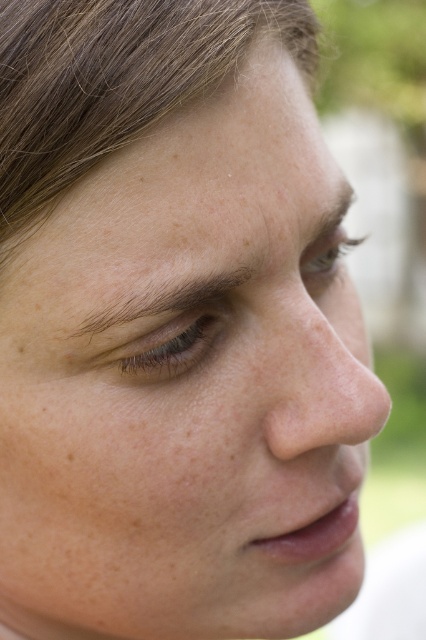
Question: Does brown smooth hair at upper left have a greater width compared to smooth skin nose at center?

Choices:
 (A) yes
 (B) no

Answer: (A)

Question: In this image, where is brown smooth hair at upper left located relative to smooth skin nose at center?

Choices:
 (A) above
 (B) below

Answer: (A)

Question: Which object is farther from the camera taking this photo?

Choices:
 (A) light brown eye at upper center
 (B) brown matte eye at center
 (C) smooth skin nose at center
 (D) brown hair at upper left

Answer: (A)

Question: Which point appears closest to the camera in this image?

Choices:
 (A) (86, 28)
 (B) (304, 436)

Answer: (A)

Question: Which point is farther to the camera?

Choices:
 (A) smooth skin nose at center
 (B) brown smooth hair at upper left
 (C) brown hair at upper left
 (D) light brown eye at upper center

Answer: (D)

Question: Is brown matte eye at center to the right of brown hair at upper left from the viewer's perspective?

Choices:
 (A) no
 (B) yes

Answer: (B)